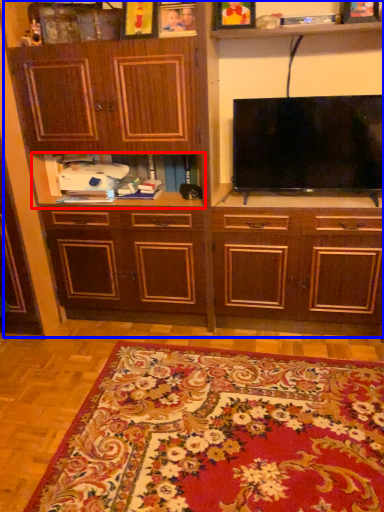
Question: Which point is closer to the camera, shelf (highlighted by a red box) or cabinetry (highlighted by a blue box)?

Choices:
 (A) shelf
 (B) cabinetry

Answer: (B)